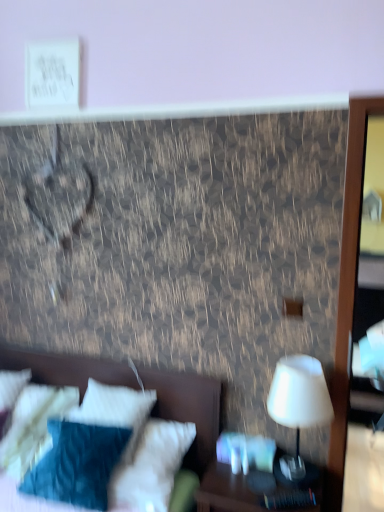
Question: From a real-world perspective, is white soft pillow at lower left, which is the second pillow in left-to-right order, beneath wooden nightstand at lower right?

Choices:
 (A) no
 (B) yes

Answer: (A)

Question: From the image's perspective, does white soft pillow at lower left, which is the second pillow in left-to-right order, appear higher than wooden nightstand at lower right?

Choices:
 (A) no
 (B) yes

Answer: (B)

Question: Does white soft pillow at lower left, which is the second pillow in left-to-right order, lie in front of wooden nightstand at lower right?

Choices:
 (A) yes
 (B) no

Answer: (B)

Question: Does white soft pillow at lower left, which is the second pillow in left-to-right order, have a lesser height compared to wooden nightstand at lower right?

Choices:
 (A) no
 (B) yes

Answer: (A)

Question: From the image's perspective, is white soft pillow at lower left, which is the second pillow in left-to-right order, beneath wooden nightstand at lower right?

Choices:
 (A) no
 (B) yes

Answer: (A)

Question: From their relative heights in the image, would you say white soft pillow at lower left, the 2th pillow positioned from the right, is taller or shorter than white matte table lamp at right?

Choices:
 (A) short
 (B) tall

Answer: (A)

Question: Is white soft pillow at lower left, the 2th pillow positioned from the right, bigger or smaller than white matte table lamp at right?

Choices:
 (A) big
 (B) small

Answer: (A)

Question: Would you say white soft pillow at lower left, the 2th pillow positioned from the right, is to the left or to the right of white matte table lamp at right in the picture?

Choices:
 (A) left
 (B) right

Answer: (A)

Question: Is point (44, 411) positioned closer to the camera than point (291, 365)?

Choices:
 (A) closer
 (B) farther

Answer: (B)

Question: Would you say white soft bed at lower left is inside or outside white soft pillow at lower left, marked as the first pillow in a left-to-right arrangement?

Choices:
 (A) outside
 (B) inside

Answer: (A)

Question: Looking at the image, does white soft bed at lower left seem bigger or smaller compared to white soft pillow at lower left, marked as the first pillow in a left-to-right arrangement?

Choices:
 (A) small
 (B) big

Answer: (B)

Question: Is white soft bed at lower left to the left or to the right of white soft pillow at lower left, the 2th pillow positioned from the right, in the image?

Choices:
 (A) right
 (B) left

Answer: (A)

Question: Is white soft bed at lower left wider or thinner than white soft pillow at lower left, marked as the first pillow in a left-to-right arrangement?

Choices:
 (A) wide
 (B) thin

Answer: (A)

Question: Would you say white soft pillow at lower left, which is the 1th pillow in right-to-left order, is inside or outside white matte table lamp at right?

Choices:
 (A) inside
 (B) outside

Answer: (B)

Question: In the image, is white soft pillow at lower left, which is the 1th pillow in right-to-left order, positioned in front of or behind white matte table lamp at right?

Choices:
 (A) front
 (B) behind

Answer: (B)